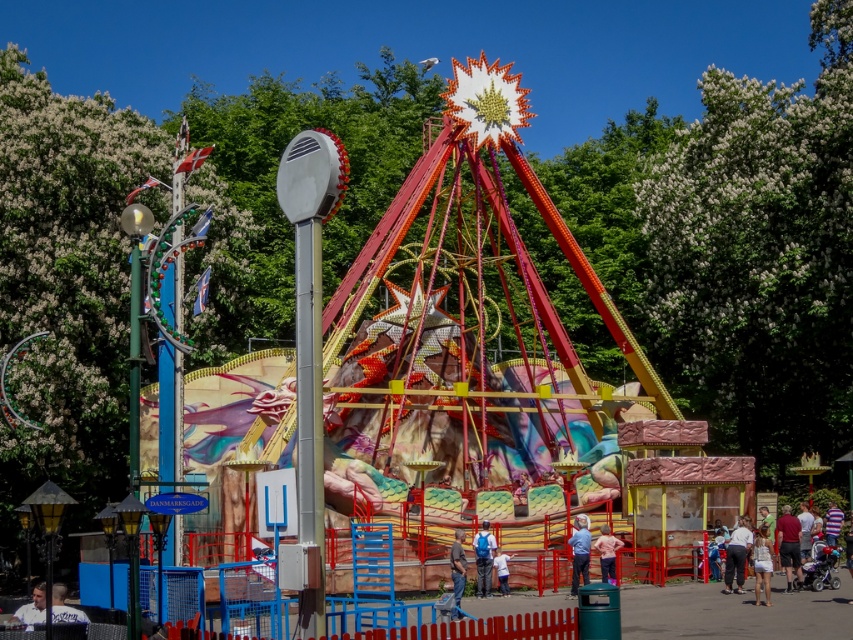
Who is positioned more to the left, white cotton shirt at lower right or light pink fabric dress at center?

light pink fabric dress at center is more to the left.

Does point (813, 576) come closer to viewer compared to point (602, 556)?

That is False.

The image size is (853, 640). In order to click on white cotton shirt at lower right in this screenshot , I will do `click(792, 556)`.

Between point (727, 572) and point (479, 552), which one is positioned behind?

Positioned behind is point (727, 572).

Can you confirm if white cotton shirt at center is wider than blue backpack at center?

No, white cotton shirt at center is not wider than blue backpack at center.

What do you see at coordinates (737, 554) in the screenshot? The height and width of the screenshot is (640, 853). I see `white cotton shirt at center` at bounding box center [737, 554].

Where is `white cotton shirt at center`? The width and height of the screenshot is (853, 640). white cotton shirt at center is located at coordinates (737, 554).

Looking at this image, can you confirm if blue backpack at center is taller than white cotton dress at center?

Incorrect, blue backpack at center's height is not larger of white cotton dress at center's.

Does blue backpack at center have a greater width compared to white cotton dress at center?

No, blue backpack at center is not wider than white cotton dress at center.

Where is `blue backpack at center`? Image resolution: width=853 pixels, height=640 pixels. blue backpack at center is located at coordinates (483, 557).